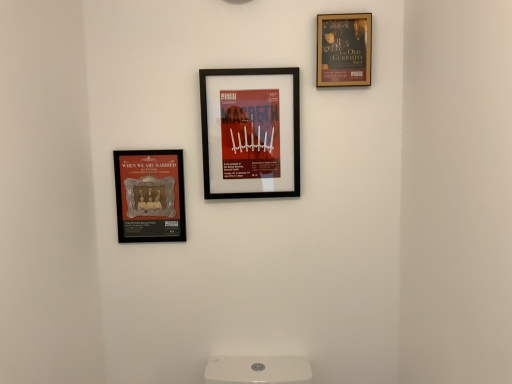
Question: Should I look upward or downward to see gold-framed poster at upper right, which ranks as the 3th picture frame in left-to-right order?

Choices:
 (A) down
 (B) up

Answer: (B)

Question: Is matte black picture frame at center, marked as the 2th picture frame in a right-to-left arrangement, beside gold-framed poster at upper right, the first picture frame positioned from the right?

Choices:
 (A) yes
 (B) no

Answer: (B)

Question: Is matte black picture frame at center, acting as the second picture frame starting from the left, not within gold-framed poster at upper right, the first picture frame positioned from the right?

Choices:
 (A) yes
 (B) no

Answer: (A)

Question: Is matte black picture frame at center, marked as the 2th picture frame in a right-to-left arrangement, bigger than gold-framed poster at upper right, which ranks as the 3th picture frame in left-to-right order?

Choices:
 (A) no
 (B) yes

Answer: (B)

Question: Is matte black picture frame at center, marked as the 2th picture frame in a right-to-left arrangement, thinner than gold-framed poster at upper right, the first picture frame positioned from the right?

Choices:
 (A) no
 (B) yes

Answer: (A)

Question: From the image's perspective, would you say matte black picture frame at center, acting as the second picture frame starting from the left, is shown under gold-framed poster at upper right, the first picture frame positioned from the right?

Choices:
 (A) yes
 (B) no

Answer: (A)

Question: Considering the relative positions of matte black picture frame at center, acting as the second picture frame starting from the left, and gold-framed poster at upper right, which ranks as the 3th picture frame in left-to-right order, in the image provided, is matte black picture frame at center, acting as the second picture frame starting from the left, to the right of gold-framed poster at upper right, which ranks as the 3th picture frame in left-to-right order, from the viewer's perspective?

Choices:
 (A) yes
 (B) no

Answer: (B)

Question: Is gold-framed poster at upper right, which ranks as the 3th picture frame in left-to-right order, surrounding matte black picture frame at center, marked as the 2th picture frame in a right-to-left arrangement?

Choices:
 (A) yes
 (B) no

Answer: (B)

Question: From the image's perspective, is gold-framed poster at upper right, the first picture frame positioned from the right, below matte black picture frame at center, acting as the second picture frame starting from the left?

Choices:
 (A) yes
 (B) no

Answer: (B)

Question: Does gold-framed poster at upper right, the first picture frame positioned from the right, have a greater width compared to matte black picture frame at center, acting as the second picture frame starting from the left?

Choices:
 (A) no
 (B) yes

Answer: (A)

Question: Does gold-framed poster at upper right, the first picture frame positioned from the right, have a greater height compared to matte black picture frame at center, marked as the 2th picture frame in a right-to-left arrangement?

Choices:
 (A) yes
 (B) no

Answer: (B)

Question: From the image's perspective, does gold-framed poster at upper right, which ranks as the 3th picture frame in left-to-right order, appear higher than matte black picture frame at center, marked as the 2th picture frame in a right-to-left arrangement?

Choices:
 (A) no
 (B) yes

Answer: (B)

Question: Is gold-framed poster at upper right, which ranks as the 3th picture frame in left-to-right order, positioned in front of matte black picture frame at center, acting as the second picture frame starting from the left?

Choices:
 (A) yes
 (B) no

Answer: (A)

Question: Is matte gold plaque at left, the 3th picture frame when ordered from right to left, placed right next to gold-framed poster at upper right, the first picture frame positioned from the right?

Choices:
 (A) yes
 (B) no

Answer: (B)